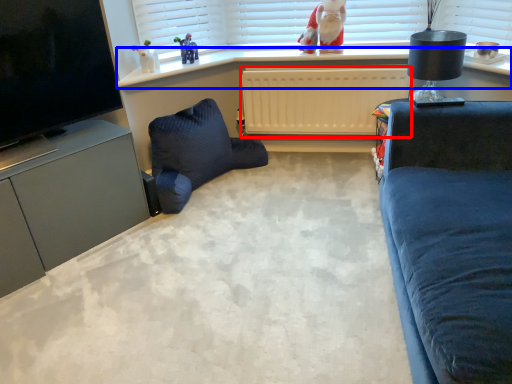
Question: Which point is further to the camera, radiator (highlighted by a red box) or window sill (highlighted by a blue box)?

Choices:
 (A) radiator
 (B) window sill

Answer: (A)